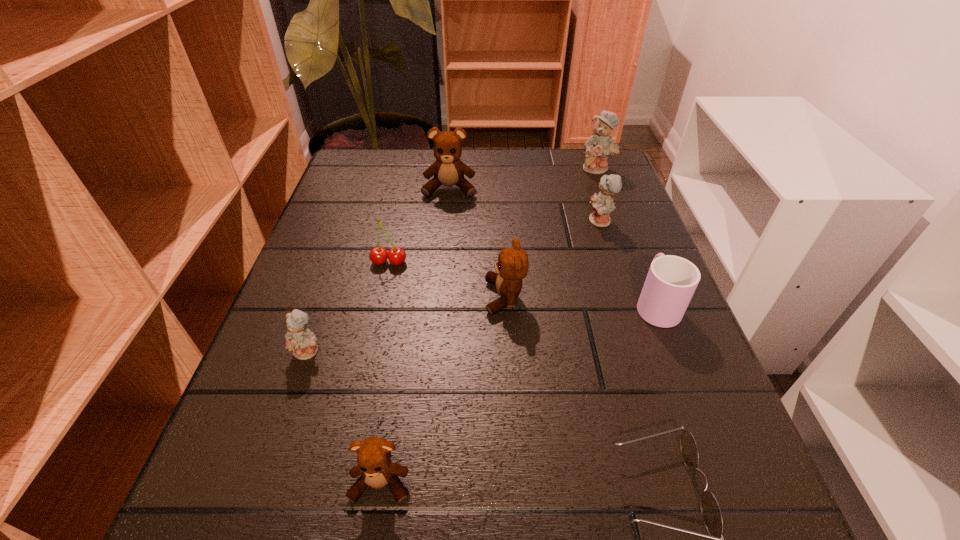
I want to click on teddy bear at the left edge, so click(x=302, y=342).

This screenshot has height=540, width=960. I want to click on cup located in the right edge section of the desktop, so click(x=671, y=281).

The height and width of the screenshot is (540, 960). What are the coordinates of `object that is at the far right corner` in the screenshot? It's located at (598, 147).

At what (x,y) coordinates should I click in order to perform the action: click on free region at the left edge of the desktop. Please return your answer as a coordinate pair (x, y). The image size is (960, 540). Looking at the image, I should click on (324, 411).

Identify the location of vacant point at the right edge. This screenshot has width=960, height=540. (705, 432).

In order to click on vacant space at the far left corner of the desktop in this screenshot , I will do `click(385, 153)`.

At what (x,y) coordinates should I click in order to perform the action: click on vacant space at the near left corner. Please return your answer as a coordinate pair (x, y). Looking at the image, I should click on (285, 495).

In the image, there is a desktop. Identify the location of vacant space at the far right corner. This screenshot has width=960, height=540. (590, 180).

This screenshot has width=960, height=540. I want to click on vacant space that's between the cup and the farthest teddy bear, so click(x=627, y=236).

Where is `empty space between the fourth farthest object and the second farthest teddy bear`? The width and height of the screenshot is (960, 540). empty space between the fourth farthest object and the second farthest teddy bear is located at coordinates point(420,225).